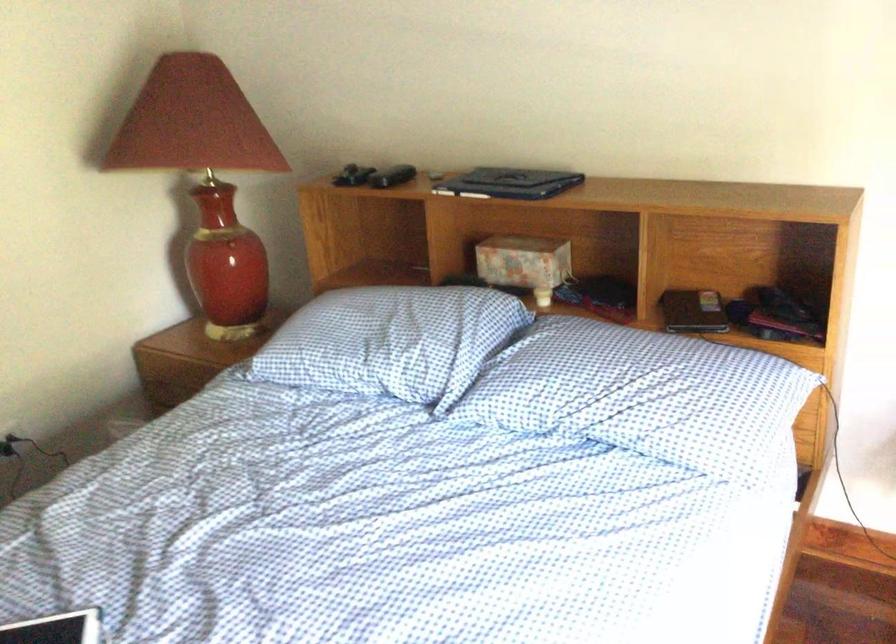
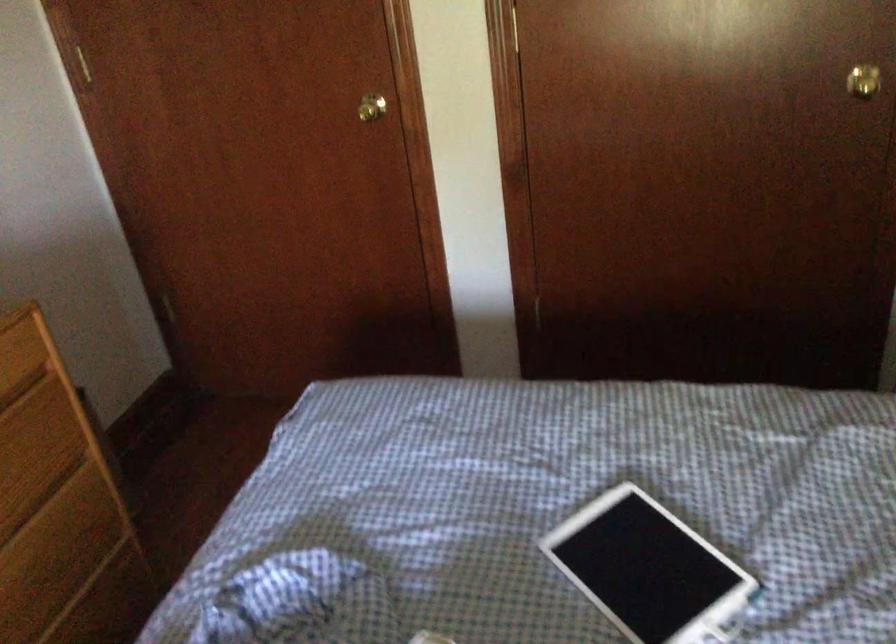
The first image is from the beginning of the video and the second image is from the end. How did the camera likely rotate when shooting the video?

The camera's rotation is toward left-down.